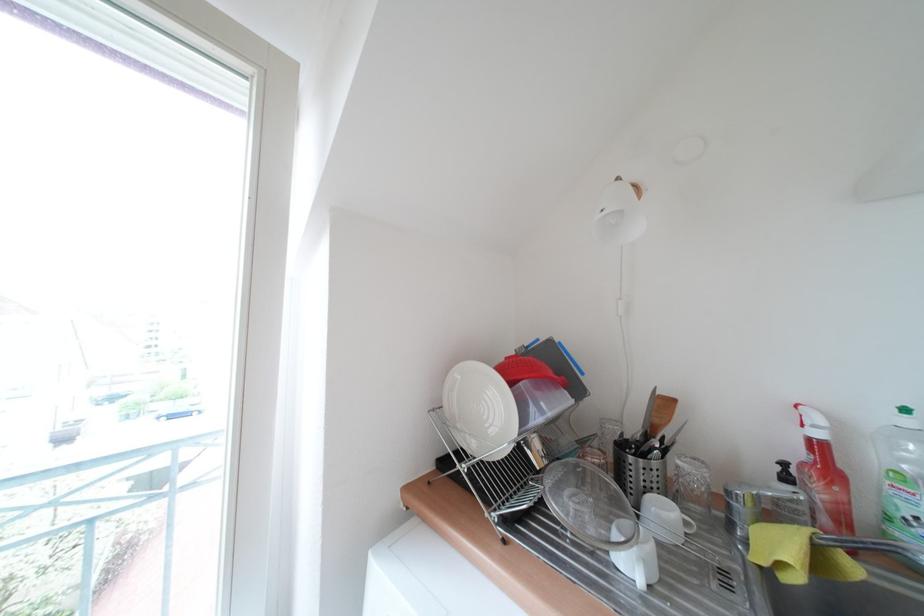
Where would you squeez the red bottle trigger? Please return your answer as a coordinate pair (x, y).

(797, 413)